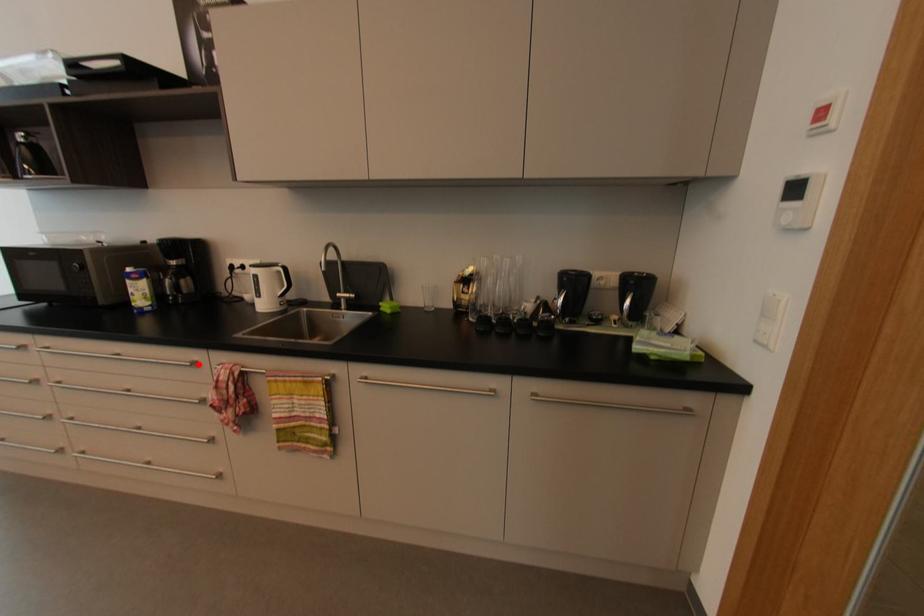
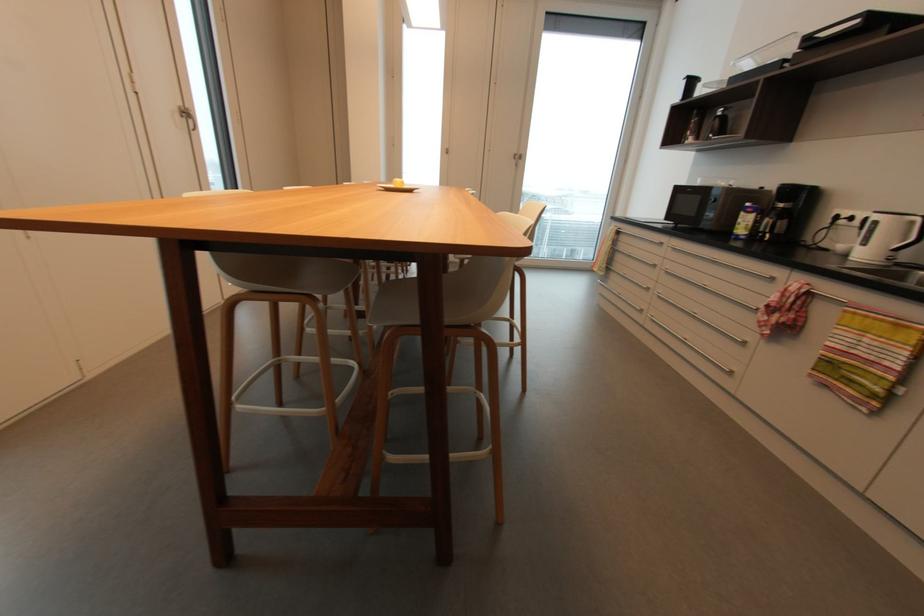
Where in the second image is the point corresponding to the highlighted location from the first image?

(775, 280)